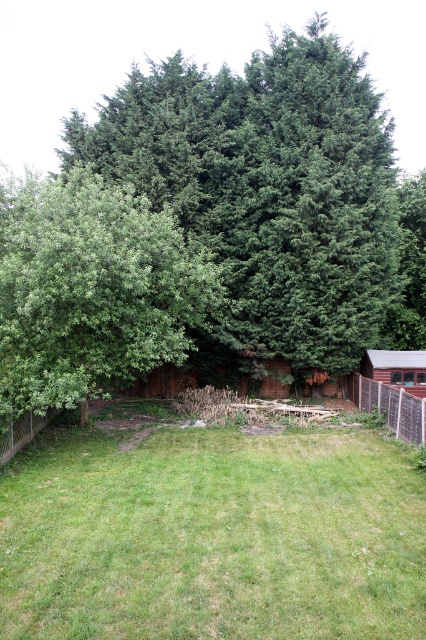
In the scene shown: Does green leafy tree at upper center have a smaller size compared to wooden fence at lower left?

No.

Which is in front, point (232, 129) or point (11, 426)?

Point (11, 426) is more forward.

Which is in front, point (400, 243) or point (28, 422)?

Positioned in front is point (28, 422).

Find the location of a particular element. This screenshot has width=426, height=640. green leafy tree at upper center is located at coordinates (267, 193).

Between green grass at center and green leafy tree at left, which one has less height?

green grass at center is shorter.

Find the location of a particular element. The image size is (426, 640). green grass at center is located at coordinates (213, 536).

Which is below, wooden fence at lower right or wooden fence at lower left?

wooden fence at lower left is lower down.

Which is more to the left, wooden fence at lower right or wooden fence at lower left?

Positioned to the left is wooden fence at lower left.

Identify the location of wooden fence at lower right. (389, 406).

This screenshot has width=426, height=640. I want to click on wooden fence at lower right, so click(x=389, y=406).